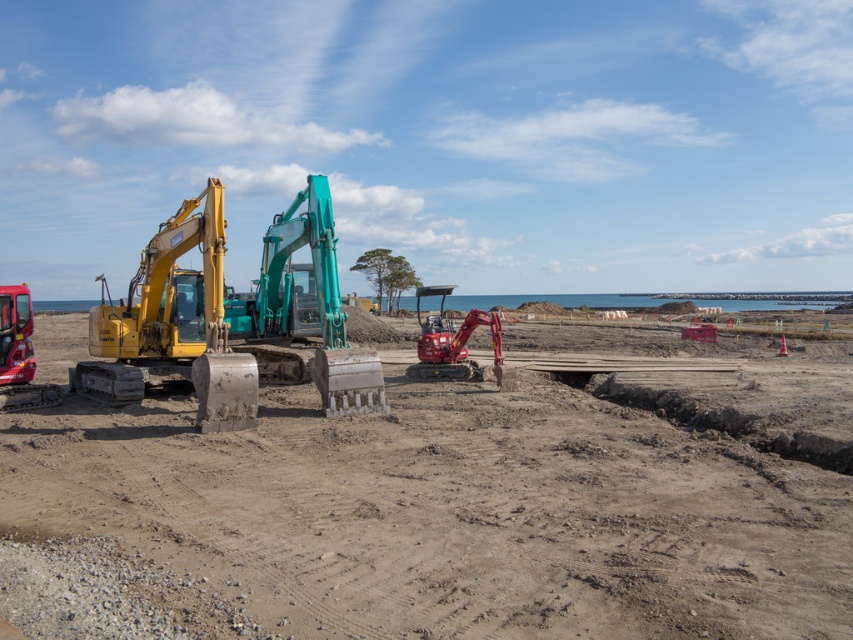
Is brown sandy beach at center bigger than matte red excavator at center?

Actually, brown sandy beach at center might be smaller than matte red excavator at center.

Can you confirm if brown sandy beach at center is smaller than matte red excavator at center?

Yes.

Where is `brown sandy beach at center`? brown sandy beach at center is located at coordinates (413, 522).

Between teal metallic excavator at center and matte red excavator at center, which one appears on the right side from the viewer's perspective?

From the viewer's perspective, matte red excavator at center appears more on the right side.

Is point (306, 193) more distant than point (444, 330)?

That is False.

Does point (281, 324) come behind point (463, 371)?

No, it is in front of (463, 371).

At what (x,y) coordinates should I click in order to perform the action: click on teal metallic excavator at center. Please return your answer as a coordinate pair (x, y). The width and height of the screenshot is (853, 640). Looking at the image, I should click on (x=317, y=304).

Which is more to the right, yellow metallic excavator at left or matte red excavator at center?

From the viewer's perspective, matte red excavator at center appears more on the right side.

Between yellow metallic excavator at left and matte red excavator at center, which one has more height?

Standing taller between the two is yellow metallic excavator at left.

You are a GUI agent. You are given a task and a screenshot of the screen. Output one action in this format:
    pyautogui.click(x=<x>, y=<y>)
    Task: Click on the yellow metallic excavator at left
    This screenshot has height=640, width=853.
    Given the screenshot: What is the action you would take?
    pyautogui.click(x=173, y=324)

In order to click on yellow metallic excavator at left in this screenshot , I will do `click(173, 324)`.